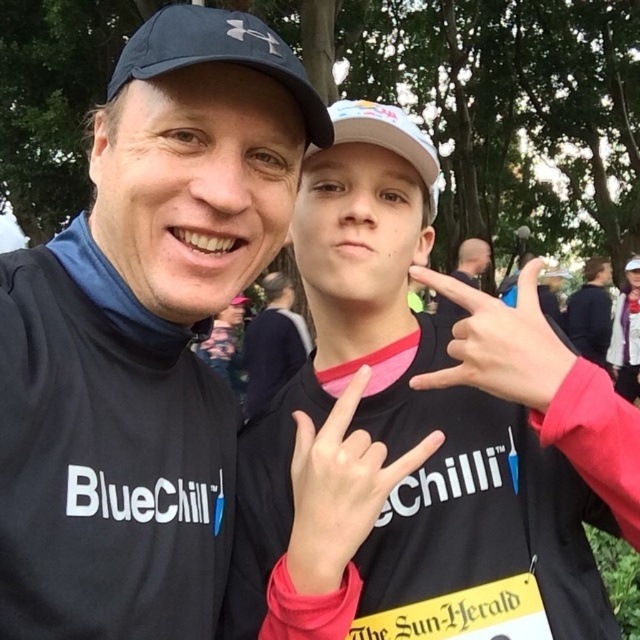
You are a photographer trying to adjust the composition of the photo. You notice the white matte hand at center and pink matte hand at center. Which hand should you ask the subject to lower to make both hands appear at the same height?

The white matte hand at center is taller than the pink matte hand at center. To make both hands appear at the same height, you should ask the subject to lower the white matte hand at center.

Looking at this image, you are a photographer trying to focus on the black matte shirt at center and the pink matte hand at center. Which object is closer to the camera?

The black matte shirt at center is positioned under the pink matte hand at center, so the pink matte hand at center is closer to the camera.